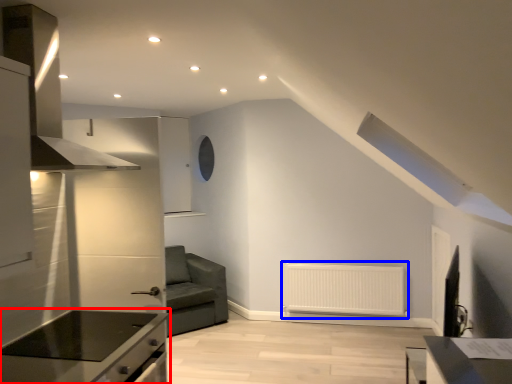
Question: Among these objects, which one is nearest to the camera, countertop (highlighted by a red box) or radiator (highlighted by a blue box)?

Choices:
 (A) countertop
 (B) radiator

Answer: (A)